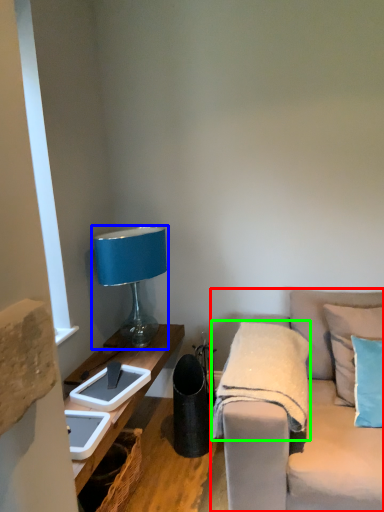
Question: Estimate the real-world distances between objects in this image. Which object is closer to studio couch (highlighted by a red box), lamp (highlighted by a blue box) or blanket (highlighted by a green box)?

Choices:
 (A) lamp
 (B) blanket

Answer: (B)